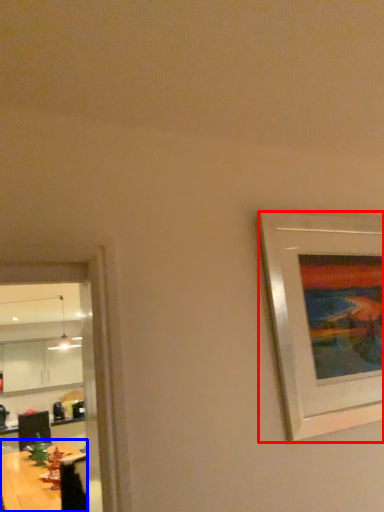
Question: Among these objects, which one is nearest to the camera, picture frame (highlighted by a red box) or table (highlighted by a blue box)?

Choices:
 (A) picture frame
 (B) table

Answer: (A)